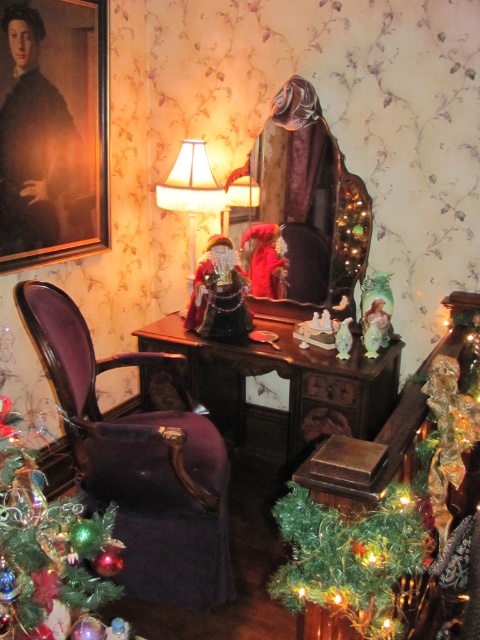
Question: Which point is farther to the camera?

Choices:
 (A) purple velvet armchair at left
 (B) shiny green garland at center
 (C) shiny green plastic tree at lower right

Answer: (A)

Question: Can you confirm if matte black portrait at upper left is positioned to the left of shiny green christmas tree at left?

Choices:
 (A) yes
 (B) no

Answer: (A)

Question: Which point appears farthest from the camera in this image?

Choices:
 (A) (396, 547)
 (B) (354, 388)

Answer: (B)

Question: Can you confirm if purple velvet armchair at left is thinner than shiny green christmas tree at left?

Choices:
 (A) yes
 (B) no

Answer: (B)

Question: Does shiny green garland at center appear on the left side of matte cream lampshade at center?

Choices:
 (A) no
 (B) yes

Answer: (A)

Question: Which object is the farthest from the matte cream lampshade at center?

Choices:
 (A) shiny green garland at center
 (B) shiny green christmas tree at left

Answer: (B)